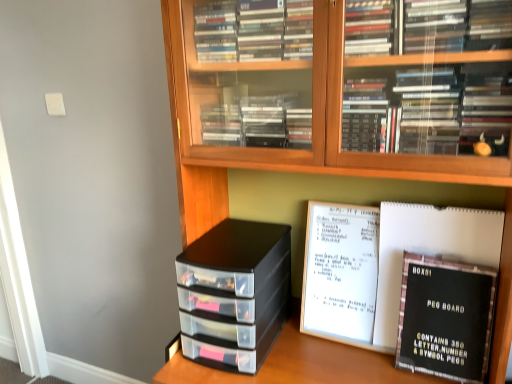
Describe the element at coordinates (445, 318) in the screenshot. The height and width of the screenshot is (384, 512). I see `black cardboard peg board at lower right` at that location.

This screenshot has width=512, height=384. What are the coordinates of `black matte peg board at center right` in the screenshot? It's located at (426, 251).

Measure the distance between wooden bookcase at center and camera.

The depth of wooden bookcase at center is 32.36 inches.

The height and width of the screenshot is (384, 512). Find the location of `black cardboard peg board at lower right`. black cardboard peg board at lower right is located at coordinates (445, 318).

Is wooden bookcase at center located within black matte peg board at center right?

Actually, wooden bookcase at center is outside black matte peg board at center right.

Is black matte peg board at center right taller or shorter than wooden bookcase at center?

Considering their sizes, black matte peg board at center right has less height than wooden bookcase at center.

From the image's perspective, is wooden bookcase at center under black cardboard peg board at lower right?

No.

Is point (325, 377) closer to camera compared to point (492, 294)?

That is False.

Locate an element on the screen. This screenshot has height=384, width=512. book behind the wooden bookcase at center is located at coordinates (445, 318).

Would you say wooden bookcase at center is a long distance from black cardboard peg board at lower right?

wooden bookcase at center is near black cardboard peg board at lower right, not far away.

From the image's perspective, does wooden bookcase at center appear higher than black plastic storage drawers at center?

Yes, from the image's perspective, wooden bookcase at center is above black plastic storage drawers at center.

Is wooden bookcase at center bigger than black plastic storage drawers at center?

Correct, wooden bookcase at center is larger in size than black plastic storage drawers at center.

Consider the image. Which object is thinner, wooden bookcase at center or black plastic storage drawers at center?

Thinner between the two is black plastic storage drawers at center.

Considering the relative sizes of wooden bookcase at center and black plastic storage drawers at center in the image provided, is wooden bookcase at center taller than black plastic storage drawers at center?

Yes, wooden bookcase at center is taller than black plastic storage drawers at center.

Considering the relative sizes of black plastic storage drawers at center and wooden bookcase at center in the image provided, is black plastic storage drawers at center bigger than wooden bookcase at center?

Actually, black plastic storage drawers at center might be smaller than wooden bookcase at center.

Is black plastic storage drawers at center facing away from wooden bookcase at center?

Absolutely, black plastic storage drawers at center is directed away from wooden bookcase at center.

From the image's perspective, between black plastic storage drawers at center and wooden bookcase at center, who is located below?

black plastic storage drawers at center.

From the image's perspective, between wooden bookcase at center and black matte peg board at center right, who is located below?

From the image's view, black matte peg board at center right is below.

What's the angular difference between wooden bookcase at center and black matte peg board at center right's facing directions?

There is a 1.85-degree angle between the facing directions of wooden bookcase at center and black matte peg board at center right.

Which is less distant, (x=176, y=82) or (x=400, y=266)?

The point (x=176, y=82) is in front.

Considering the sizes of objects wooden bookcase at center and black matte peg board at center right in the image provided, who is wider, wooden bookcase at center or black matte peg board at center right?

wooden bookcase at center.

From a real-world perspective, which object stands above the other?

black plastic storage drawers at center.

Is black cardboard peg board at lower right oriented towards black plastic storage drawers at center?

No, black cardboard peg board at lower right is not turned towards black plastic storage drawers at center.

How distant is black cardboard peg board at lower right from black plastic storage drawers at center?

They are 47.45 centimeters apart.

Who is shorter, black cardboard peg board at lower right or black plastic storage drawers at center?

black cardboard peg board at lower right is shorter.

Is black cardboard peg board at lower right far from wooden bookcase at center?

That's not correct — black cardboard peg board at lower right is a little close to wooden bookcase at center.

From the picture: Can you confirm if black cardboard peg board at lower right is bigger than wooden bookcase at center?

Actually, black cardboard peg board at lower right might be smaller than wooden bookcase at center.

From a real-world perspective, between black cardboard peg board at lower right and wooden bookcase at center, who is vertically lower?

black cardboard peg board at lower right, from a real-world perspective.

Which of these two, black cardboard peg board at lower right or wooden bookcase at center, stands shorter?

black cardboard peg board at lower right is shorter.

Find the location of a particular element. bookcase that appears in front of the black matte peg board at center right is located at coordinates (240, 159).

The image size is (512, 384). Identify the location of bookcase on the left of black cardboard peg board at lower right. (240, 159).

From the image, which object appears to be nearer to black plastic storage drawers at center, wooden bookcase at center or black matte peg board at center right?

The object closer to black plastic storage drawers at center is wooden bookcase at center.

Considering their positions, is black plastic storage drawers at center positioned further to black cardboard peg board at lower right than black matte peg board at center right?

black plastic storage drawers at center is further to black cardboard peg board at lower right.

Based on their spatial positions, is black matte peg board at center right or wooden bookcase at center closer to black cardboard peg board at lower right?

The object closer to black cardboard peg board at lower right is black matte peg board at center right.

When comparing their distances from black matte peg board at center right, does black plastic storage drawers at center or wooden bookcase at center seem further?

black plastic storage drawers at center is further to black matte peg board at center right.

Based on the photo, which object lies nearer to the anchor point black cardboard peg board at lower right, black plastic storage drawers at center or wooden bookcase at center?

Among the two, wooden bookcase at center is located nearer to black cardboard peg board at lower right.

From the image, which object appears to be nearer to black cardboard peg board at lower right, wooden bookcase at center or black matte peg board at center right?

The object closer to black cardboard peg board at lower right is black matte peg board at center right.

Based on their spatial positions, is black plastic storage drawers at center or black cardboard peg board at lower right closer to black matte peg board at center right?

Based on the image, black cardboard peg board at lower right appears to be nearer to black matte peg board at center right.

Estimate the real-world distances between objects in this image. Which object is closer to wooden bookcase at center, black cardboard peg board at lower right or black matte peg board at center right?

black matte peg board at center right is positioned closer to the anchor wooden bookcase at center.

I want to click on journal between wooden bookcase at center and black plastic storage drawers at center along the z-axis, so click(x=426, y=251).

Locate an element on the screen. book positioned between wooden bookcase at center and black matte peg board at center right from near to far is located at coordinates (445, 318).

Locate an element on the screen. Image resolution: width=512 pixels, height=384 pixels. journal situated between black plastic storage drawers at center and black cardboard peg board at lower right from left to right is located at coordinates (426, 251).

Where is `book between wooden bookcase at center and black plastic storage drawers at center from front to back`? The image size is (512, 384). book between wooden bookcase at center and black plastic storage drawers at center from front to back is located at coordinates tap(445, 318).